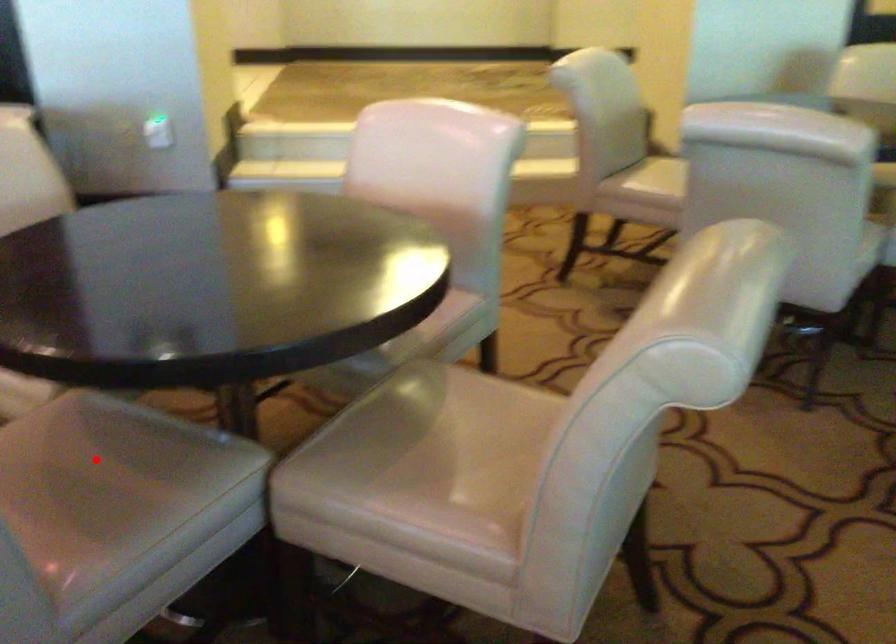
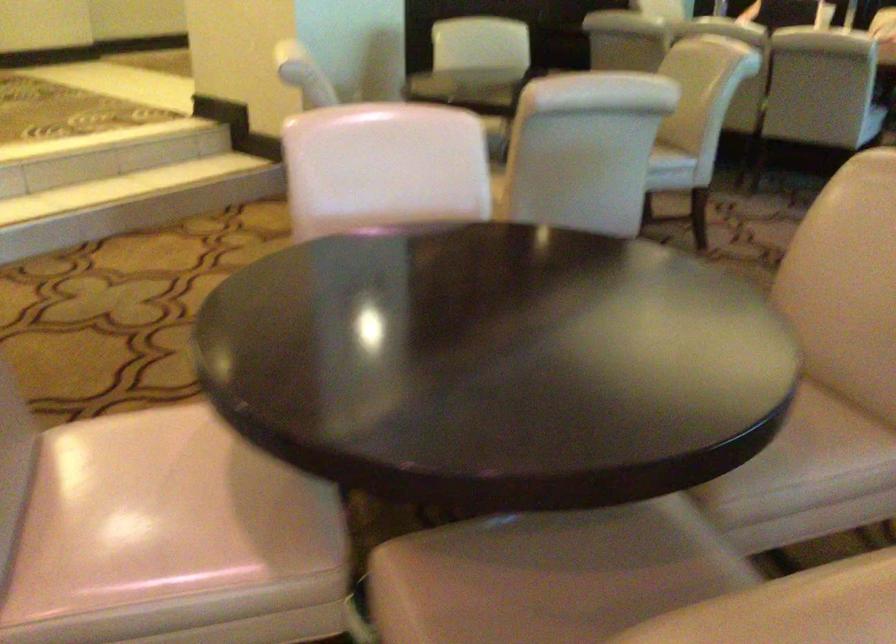
Locate, in the second image, the point that corresponds to the highlighted location in the first image.

(556, 585)